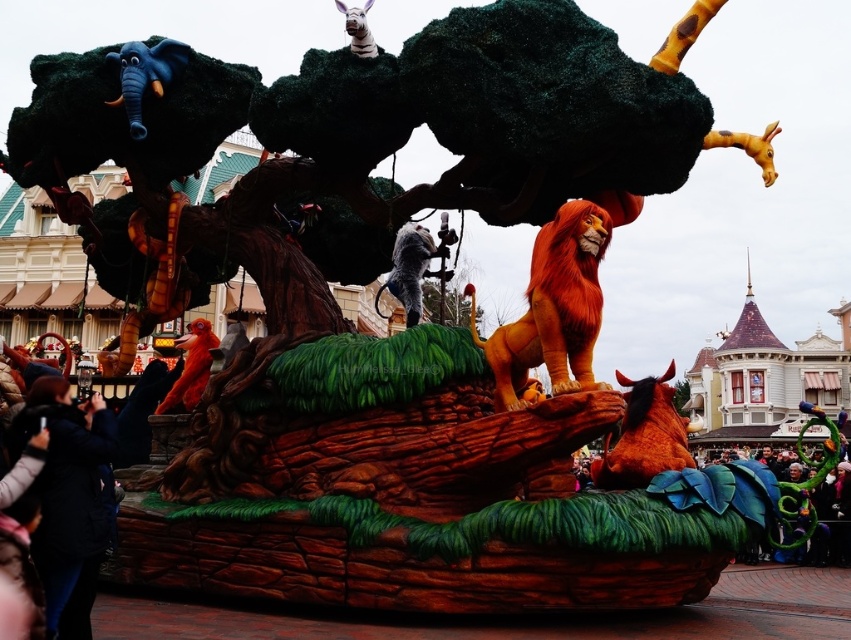
Can you confirm if shiny silver monkey at center is wider than velvet red lion at center?

No, shiny silver monkey at center is not wider than velvet red lion at center.

In the scene shown: Can you confirm if shiny silver monkey at center is taller than velvet red lion at center?

Indeed, shiny silver monkey at center has a greater height compared to velvet red lion at center.

Does point (421, 260) lie behind point (189, 330)?

No, (421, 260) is closer to viewer.

Locate an element on the screen. The height and width of the screenshot is (640, 851). shiny silver monkey at center is located at coordinates (415, 266).

Can you confirm if black jacket at lower left is thinner than matte blue elephant at upper left?

In fact, black jacket at lower left might be wider than matte blue elephant at upper left.

Does point (60, 548) lie in front of point (132, 116)?

Yes, point (60, 548) is in front of point (132, 116).

Image resolution: width=851 pixels, height=640 pixels. I want to click on black jacket at lower left, so (x=71, y=499).

What are the coordinates of `black jacket at lower left` in the screenshot? It's located at (71, 499).

Does orange plush lion at center have a greater width compared to matte blue elephant at upper left?

Correct, the width of orange plush lion at center exceeds that of matte blue elephant at upper left.

Who is higher up, orange plush lion at center or matte blue elephant at upper left?

matte blue elephant at upper left is higher up.

This screenshot has width=851, height=640. In order to click on orange plush lion at center in this screenshot , I will do `click(553, 308)`.